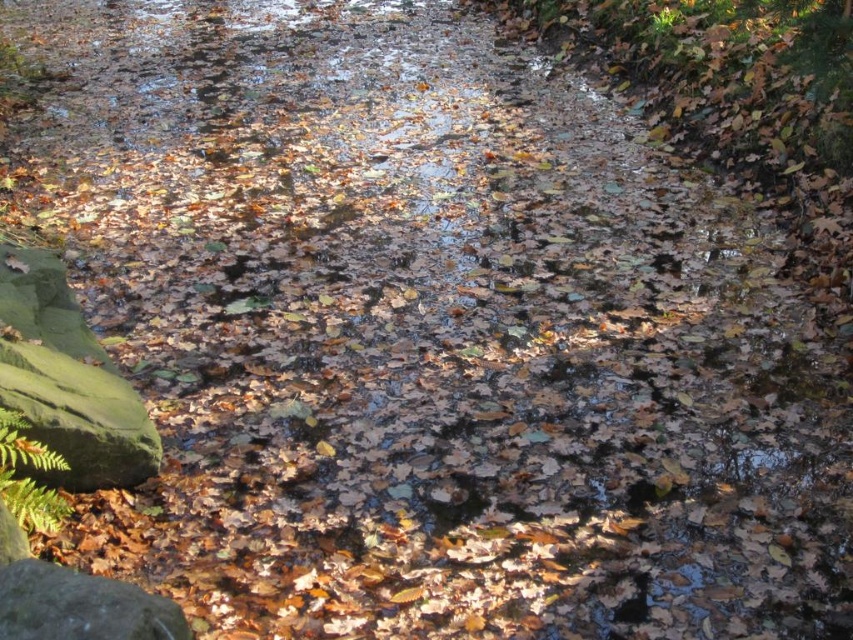
Question: Does green mossy rock at lower left appear over matte gray rock at lower left?

Choices:
 (A) no
 (B) yes

Answer: (B)

Question: Does green mossy rock at lower left lie behind matte gray rock at lower left?

Choices:
 (A) yes
 (B) no

Answer: (A)

Question: Which point appears farthest from the camera in this image?

Choices:
 (A) (4, 362)
 (B) (94, 579)

Answer: (A)

Question: Does green mossy rock at lower left come behind matte gray rock at lower left?

Choices:
 (A) no
 (B) yes

Answer: (B)